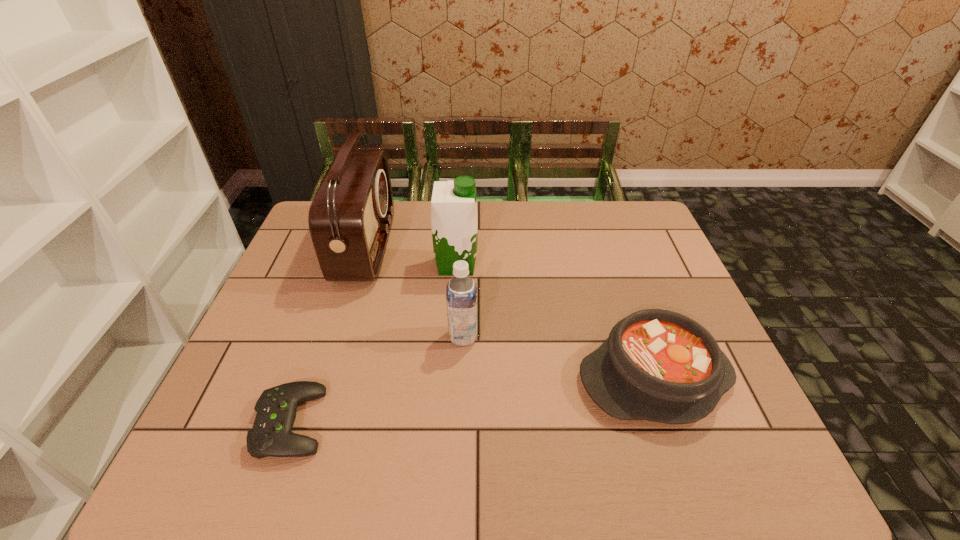
The width and height of the screenshot is (960, 540). In order to click on blank space located on the label of the shorter soya milk in this screenshot , I will do `click(612, 336)`.

Locate an element on the screen. This screenshot has width=960, height=540. blank area located on the back of the rightmost object is located at coordinates 622,285.

The width and height of the screenshot is (960, 540). Find the location of `vacant space positioned 0.180m on the back of the shortest object`. vacant space positioned 0.180m on the back of the shortest object is located at coordinates (324, 328).

This screenshot has width=960, height=540. I want to click on object present at the far edge, so click(350, 218).

Locate an element on the screen. object that is at the near edge is located at coordinates (271, 435).

You are a GUI agent. You are given a task and a screenshot of the screen. Output one action in this format:
    pyautogui.click(x=<x>, y=<y>)
    Task: Click on the radio receiver present at the left edge
    The image size is (960, 540).
    Given the screenshot: What is the action you would take?
    pyautogui.click(x=350, y=218)

Identify the location of control located at the left edge. (271, 435).

I want to click on object located in the right edge section of the desktop, so click(x=658, y=365).

At what (x,y) coordinates should I click in order to perform the action: click on object at the far left corner. Please return your answer as a coordinate pair (x, y). This screenshot has height=540, width=960. Looking at the image, I should click on (350, 218).

At what (x,y) coordinates should I click in order to perform the action: click on object at the near left corner. Please return your answer as a coordinate pair (x, y). Image resolution: width=960 pixels, height=540 pixels. Looking at the image, I should click on (271, 435).